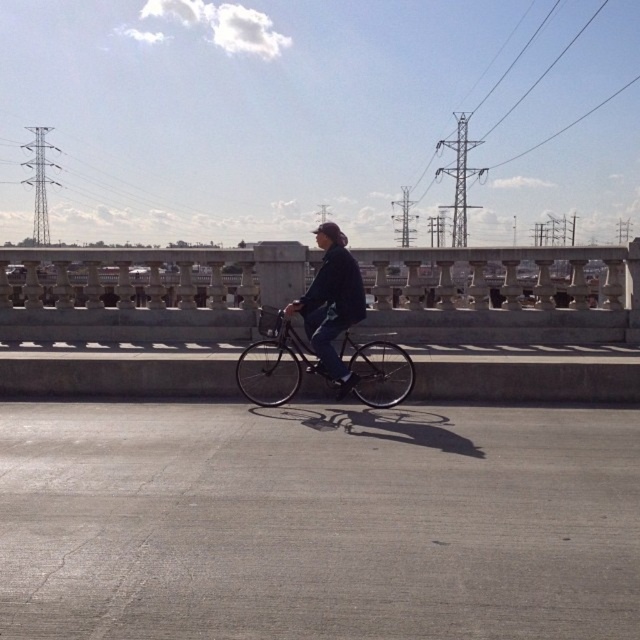
Does point (356, 396) come behind point (332, 266)?

Yes, it is.

Is point (390, 397) behind point (308, 305)?

Yes, it is.

Image resolution: width=640 pixels, height=640 pixels. I want to click on shiny black bicycle at center, so click(275, 362).